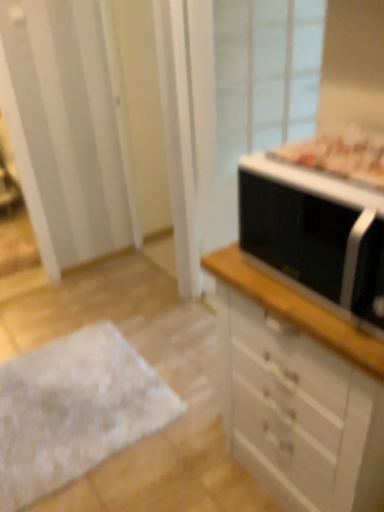
Where is `blank space situated above white fluffy rug at lower left (from a real-world perspective)`? This screenshot has width=384, height=512. blank space situated above white fluffy rug at lower left (from a real-world perspective) is located at coordinates (72, 389).